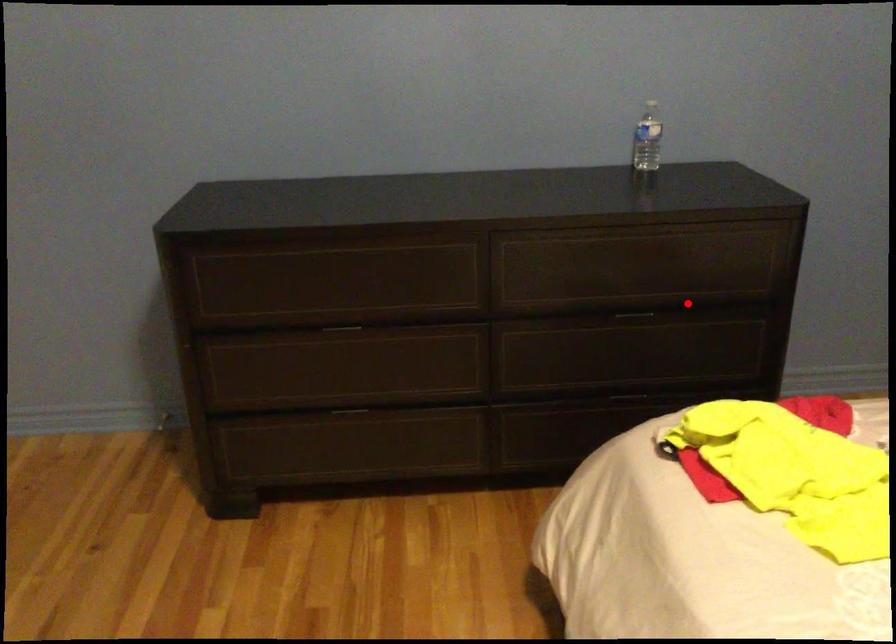
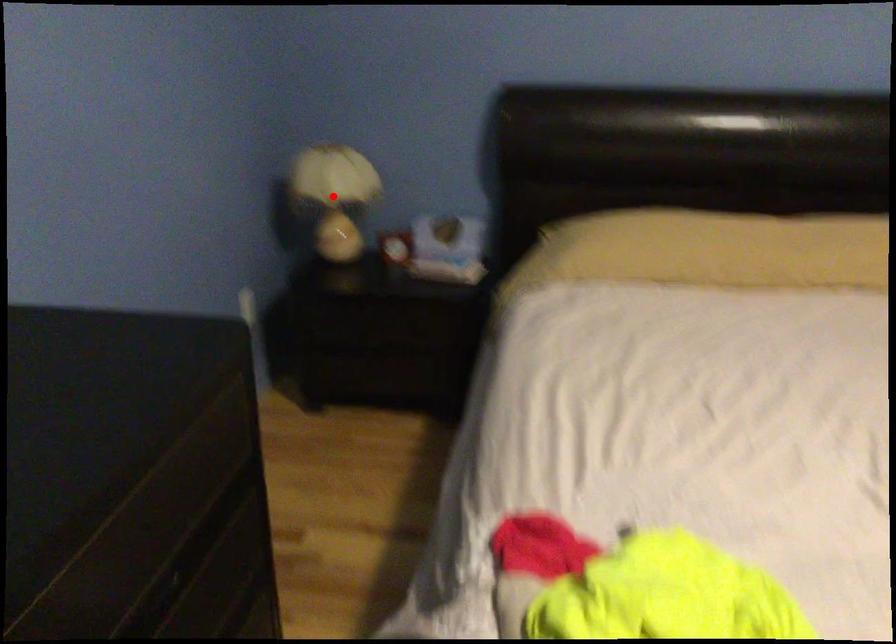
I am providing you with two images of the same scene from different viewpoints. A red point is marked on the first image and another point is marked on the second image. Is the marked point in image1 the same physical position as the marked point in image2?

No